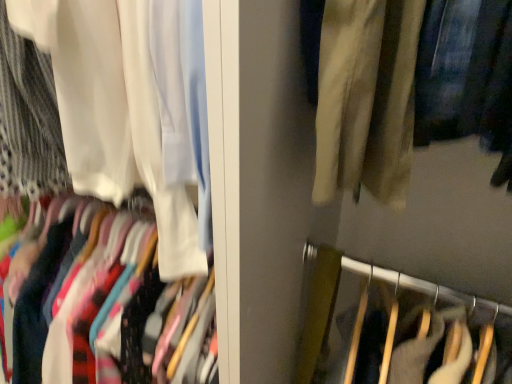
Question: Is velvet fabric pants at center inside or outside of white sheer curtain at upper left?

Choices:
 (A) inside
 (B) outside

Answer: (B)

Question: From the image's perspective, is velvet fabric pants at center located above or below white sheer curtain at upper left?

Choices:
 (A) above
 (B) below

Answer: (B)

Question: Does point [x=327, y=302] appear closer or farther from the camera than point [x=166, y=278]?

Choices:
 (A) closer
 (B) farther

Answer: (B)

Question: Is white sheer curtain at upper left situated inside velvet fabric pants at center or outside?

Choices:
 (A) inside
 (B) outside

Answer: (B)

Question: Is white sheer curtain at upper left taller or shorter than velvet fabric pants at center?

Choices:
 (A) tall
 (B) short

Answer: (B)

Question: Is white sheer curtain at upper left to the left or to the right of velvet fabric pants at center in the image?

Choices:
 (A) left
 (B) right

Answer: (A)

Question: Considering their positions, is white sheer curtain at upper left located in front of or behind velvet fabric pants at center?

Choices:
 (A) front
 (B) behind

Answer: (A)